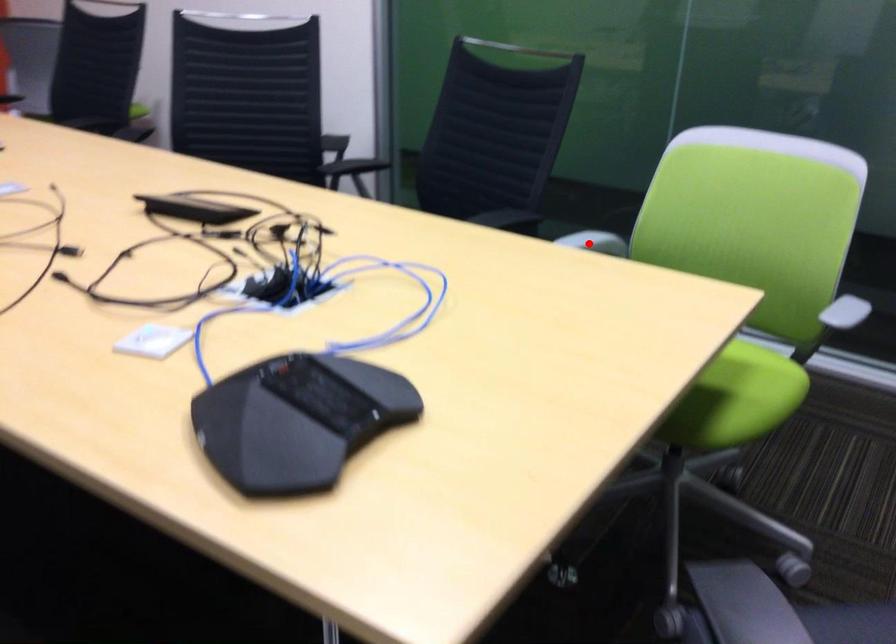
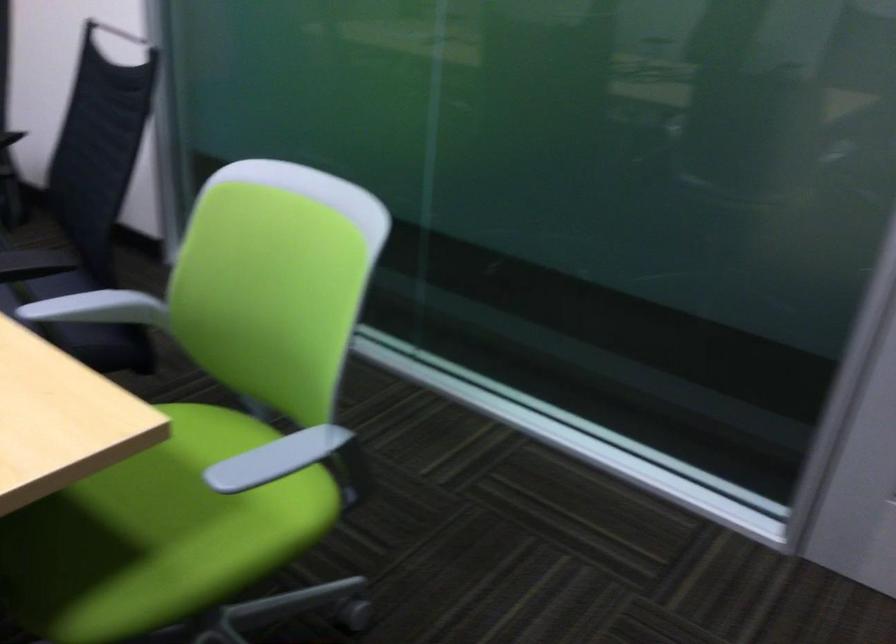
Question: I am providing you with two images of the same scene from different viewpoints. In image1, a red point is highlighted. Considering the same 3D point in image2, which of the following is correct?

Choices:
 (A) It is closer
 (B) It is farther

Answer: (A)